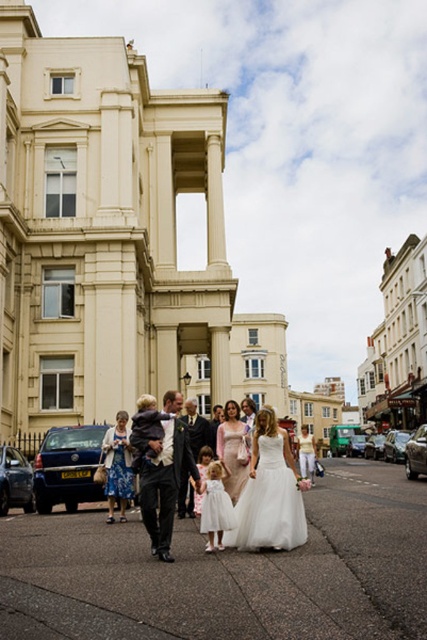
Which of these two, dark gray suit at center or satin white dress at center, stands taller?

dark gray suit at center is taller.

Who is positioned more to the left, dark gray suit at center or satin white dress at center?

Positioned to the left is dark gray suit at center.

Is point (166, 556) farther from camera compared to point (236, 476)?

No, it is in front of (236, 476).

Identify the location of dark gray suit at center. This screenshot has width=427, height=640. (158, 470).

Who is lower down, matte white dress at center or dark suit at center?

Positioned lower is dark suit at center.

Describe the element at coordinates (263, 499) in the screenshot. I see `matte white dress at center` at that location.

Find the location of a particular element. matte white dress at center is located at coordinates (263, 499).

Does point (169, 397) come closer to viewer compared to point (228, 428)?

Yes.

Can you confirm if matte white dress at center is wider than satin white dress at center?

A: Yes.

Find the location of a particular element. The image size is (427, 640). matte white dress at center is located at coordinates (263, 499).

What are the coordinates of `matte white dress at center` in the screenshot? It's located at (263, 499).